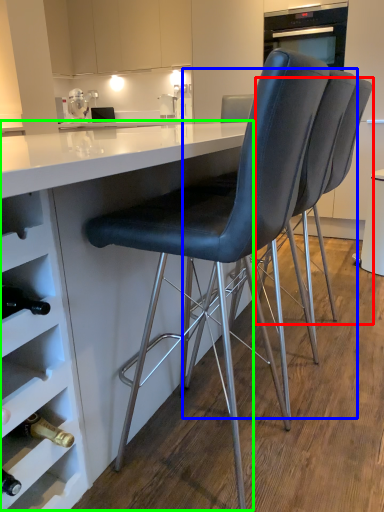
Question: Estimate the real-world distances between objects in this image. Which object is farther from chair (highlighted by a red box), chair (highlighted by a blue box) or table (highlighted by a green box)?

Choices:
 (A) chair
 (B) table

Answer: (B)